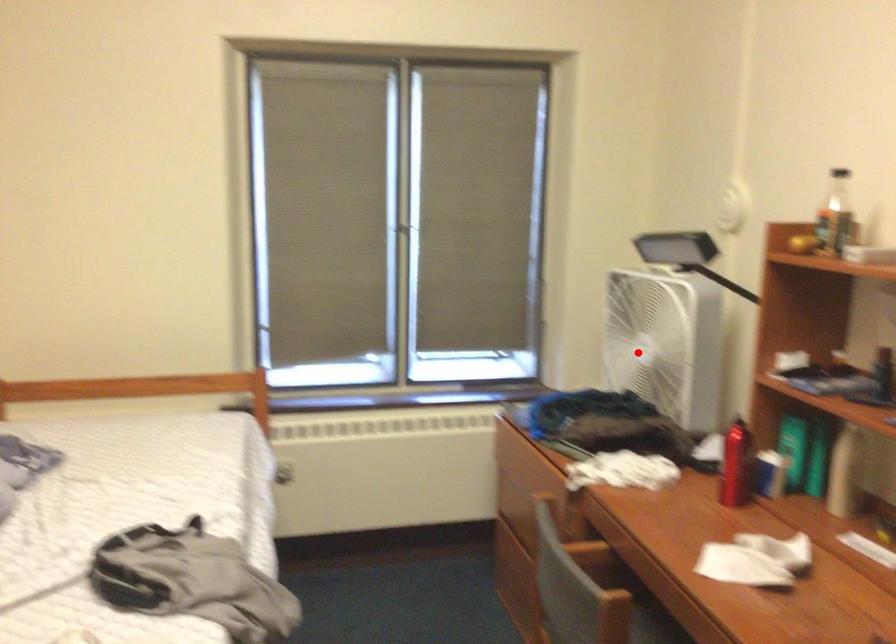
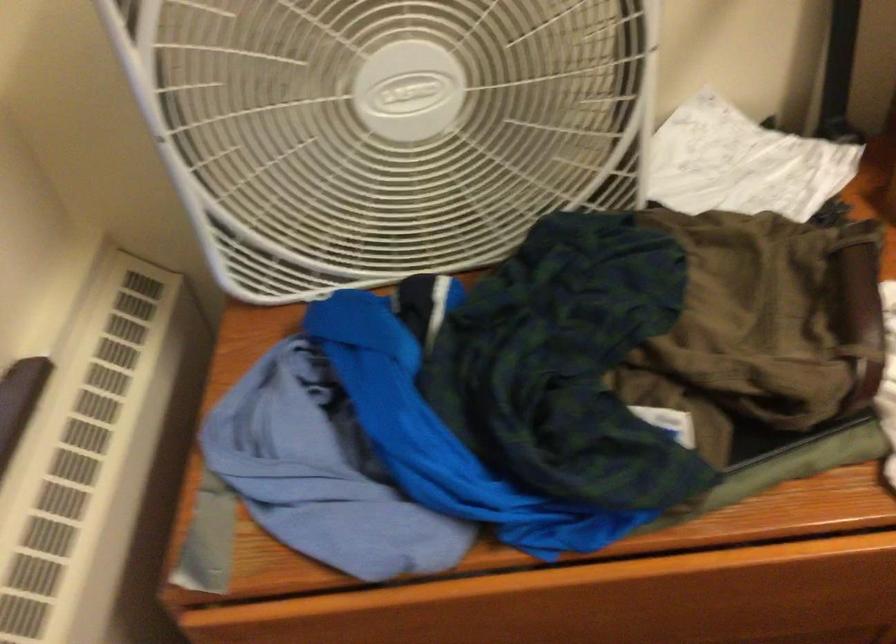
The point at the highlighted location is marked in the first image. Where is the corresponding point in the second image?

(385, 127)